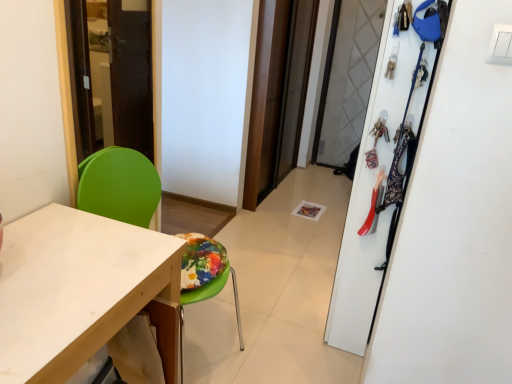
Where is `free spot behind white matte closet at upper right`? free spot behind white matte closet at upper right is located at coordinates (312, 275).